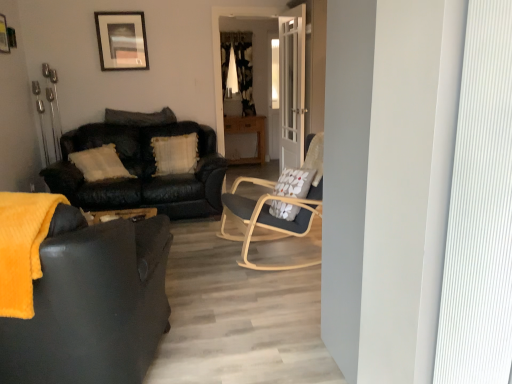
Question: Looking at their shapes, would you say matte black picture frame at upper center, which is the 1th picture frame in back-to-front order, is wider or thinner than brushed metal picture frame at upper left, the second picture frame when ordered from right to left?

Choices:
 (A) wide
 (B) thin

Answer: (A)

Question: In terms of size, does matte black picture frame at upper center, which is the 1th picture frame in back-to-front order, appear bigger or smaller than brushed metal picture frame at upper left, arranged as the 1th picture frame when viewed from the left?

Choices:
 (A) big
 (B) small

Answer: (A)

Question: Which of these objects is positioned closest to the light wood/woodenchair at center?

Choices:
 (A) brushed metal picture frame at upper left, arranged as the 1th picture frame when viewed from the left
 (B) matte black couch at left, acting as the second studio couch starting from the back
 (C) white glass door at center
 (D) matte black picture frame at upper center, which is the second picture frame in left-to-right order
 (E) black matte pillow at upper center, positioned as the second pillow in bottom-to-top order

Answer: (B)

Question: Based on their relative distances, which object is nearer to the matte black couch at left, which appears as the first studio couch when viewed from the front?

Choices:
 (A) black/white textured curtain at center
 (B) leather couch at center, placed as the 2th studio couch when sorted from front to back
 (C) white glass door at center
 (D) light wood/woodenchair at center
 (E) brushed metal picture frame at upper left, the second picture frame when ordered from right to left

Answer: (D)